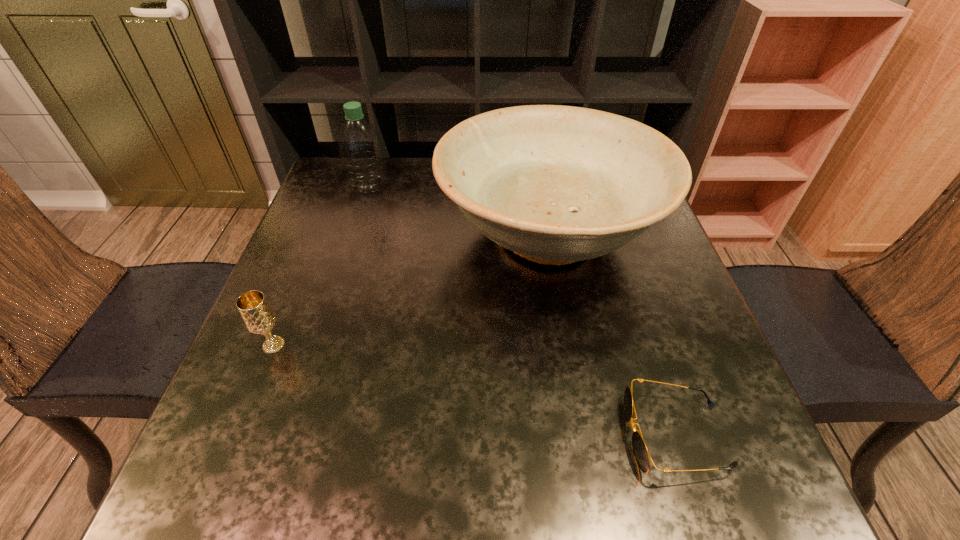
Find the location of a particular element. This screenshot has height=540, width=960. vacant space that satisfies the following two spatial constraints: 1. on the back side of the second object from left to right; 2. on the left side of the third farthest object is located at coordinates (338, 186).